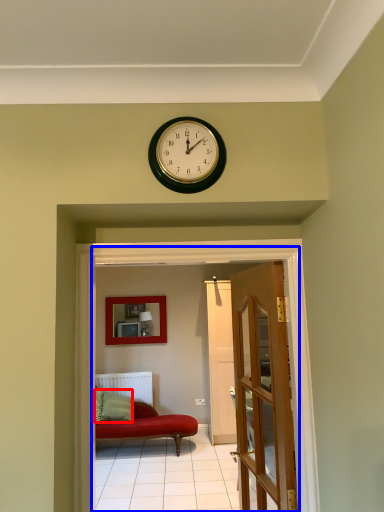
Question: Which point is closer to the camera, pillow (highlighted by a red box) or corridor (highlighted by a blue box)?

Choices:
 (A) pillow
 (B) corridor

Answer: (B)